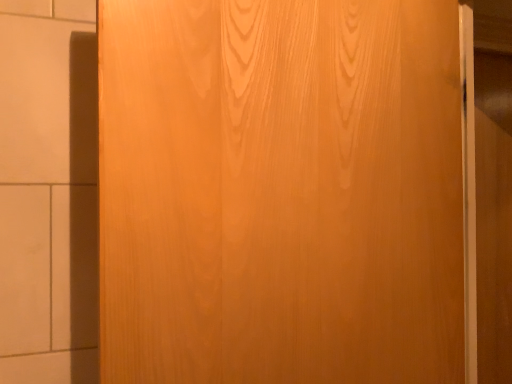
Question: Does wooden barn door at right touch wooden door at center?

Choices:
 (A) no
 (B) yes

Answer: (A)

Question: From the image's perspective, does wooden barn door at right appear lower than wooden door at center?

Choices:
 (A) yes
 (B) no

Answer: (A)

Question: Is there a large distance between wooden barn door at right and wooden door at center?

Choices:
 (A) yes
 (B) no

Answer: (B)

Question: Is wooden barn door at right located outside wooden door at center?

Choices:
 (A) no
 (B) yes

Answer: (B)

Question: Is wooden barn door at right closer to camera compared to wooden door at center?

Choices:
 (A) no
 (B) yes

Answer: (A)

Question: Does wooden barn door at right come behind wooden door at center?

Choices:
 (A) no
 (B) yes

Answer: (B)

Question: From the image's perspective, is wooden door at center located above wooden barn door at right?

Choices:
 (A) no
 (B) yes

Answer: (B)

Question: Considering the relative positions of wooden door at center and wooden barn door at right in the image provided, is wooden door at center behind wooden barn door at right?

Choices:
 (A) yes
 (B) no

Answer: (B)

Question: Would you say wooden door at center is a long distance from wooden barn door at right?

Choices:
 (A) yes
 (B) no

Answer: (B)

Question: Can you confirm if wooden door at center is thinner than wooden barn door at right?

Choices:
 (A) no
 (B) yes

Answer: (A)

Question: Is wooden door at center completely or partially outside of wooden barn door at right?

Choices:
 (A) yes
 (B) no

Answer: (A)

Question: Would you say wooden door at center contains wooden barn door at right?

Choices:
 (A) yes
 (B) no

Answer: (B)

Question: Is point (506, 200) closer or farther from the camera than point (450, 36)?

Choices:
 (A) closer
 (B) farther

Answer: (B)